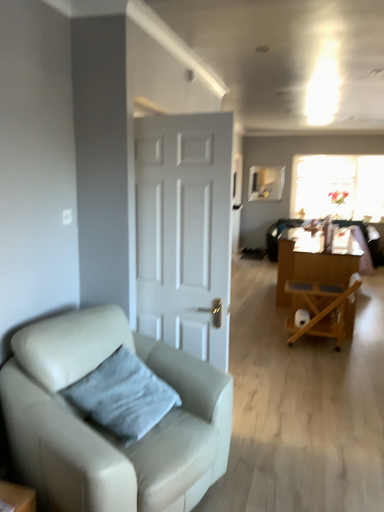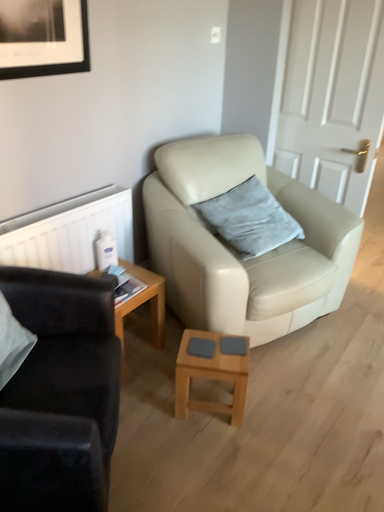
Question: How did the camera likely rotate when shooting the video?

Choices:
 (A) rotated downward
 (B) rotated upward

Answer: (A)